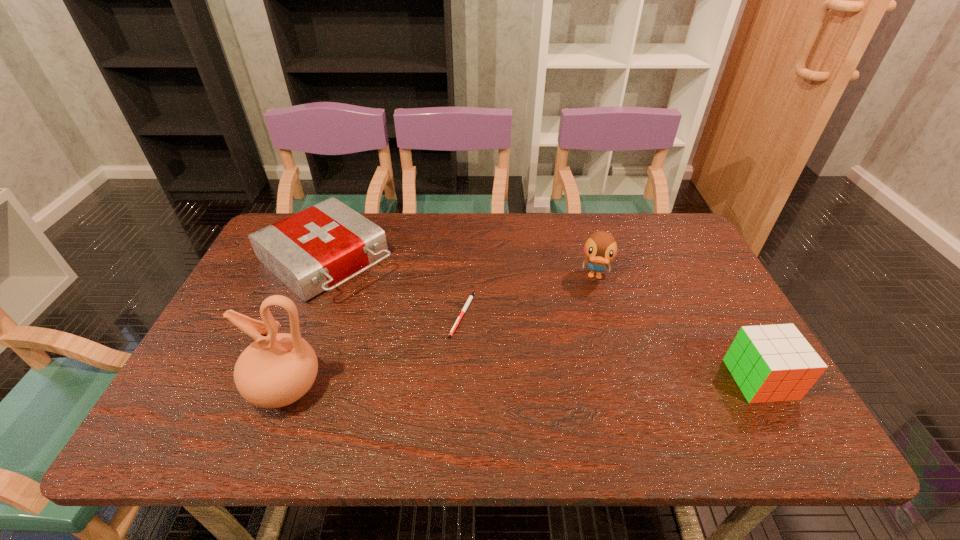
At what (x,y) coordinates should I click in order to perform the action: click on free space between the second shortest object and the cube. Please return your answer as a coordinate pair (x, y). Image resolution: width=960 pixels, height=540 pixels. Looking at the image, I should click on (543, 320).

At what (x,y) coordinates should I click in order to perform the action: click on free spot between the tallest object and the rightmost object. Please return your answer as a coordinate pair (x, y). This screenshot has width=960, height=540. Looking at the image, I should click on (523, 384).

Where is `free spot between the shortest object and the fourth object from left to right`? free spot between the shortest object and the fourth object from left to right is located at coordinates (529, 295).

I want to click on free space that is in between the pottery and the second shortest object, so click(307, 324).

Identify which object is located as the second nearest to the fourth tallest object. Please provide its 2D coordinates. Your answer should be formatted as a tuple, i.e. [(x, y)], where the tuple contains the x and y coordinates of a point satisfying the conditions above.

[(470, 298)]

The height and width of the screenshot is (540, 960). What are the coordinates of `object that is the second closest to the first-aid kit` in the screenshot? It's located at (470, 298).

This screenshot has width=960, height=540. Find the location of `vacant point that satisfies the following two spatial constraints: 1. on the back side of the fourth object from left to right; 2. on the right side of the third object from left to right`. vacant point that satisfies the following two spatial constraints: 1. on the back side of the fourth object from left to right; 2. on the right side of the third object from left to right is located at coordinates (464, 276).

This screenshot has width=960, height=540. In order to click on vacant space that satisfies the following two spatial constraints: 1. on the front side of the first-aid kit; 2. on the left side of the second object from right to left in this screenshot , I will do `click(320, 276)`.